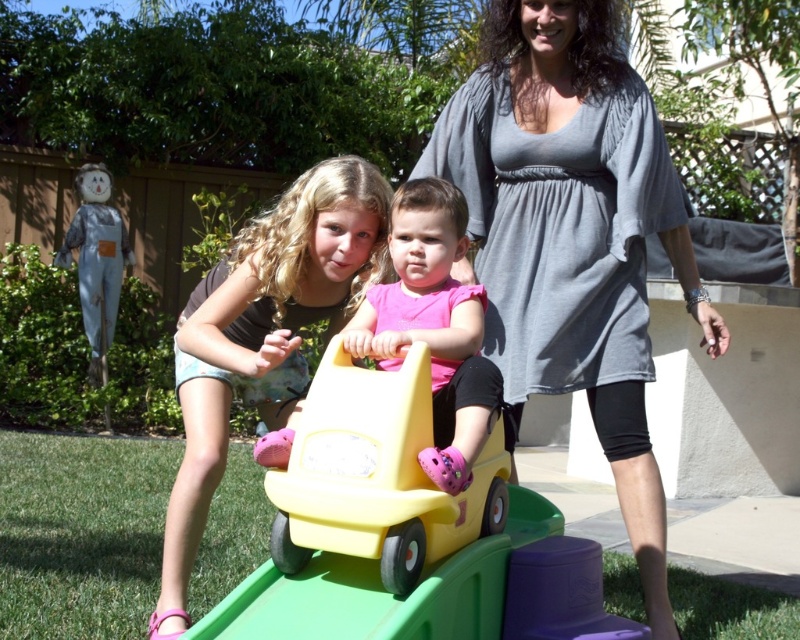
Question: Does matte pink shorts at center appear on the left side of pink matte car seat at center?

Choices:
 (A) no
 (B) yes

Answer: (B)

Question: Estimate the real-world distances between objects in this image. Which object is closer to the yellow plastic toy car at center?

Choices:
 (A) pink matte car seat at center
 (B) gray cotton dress at center
 (C) yellow plastic car at center

Answer: (C)

Question: Which of the following is the closest to the observer?

Choices:
 (A) (324, 316)
 (B) (276, 484)

Answer: (B)

Question: Which point is closer to the camera?

Choices:
 (A) (390, 444)
 (B) (520, 349)

Answer: (A)

Question: Is gray cotton dress at center wider than pink matte car seat at center?

Choices:
 (A) yes
 (B) no

Answer: (A)

Question: Can you confirm if gray cotton dress at center is positioned above pink matte car seat at center?

Choices:
 (A) yes
 (B) no

Answer: (A)